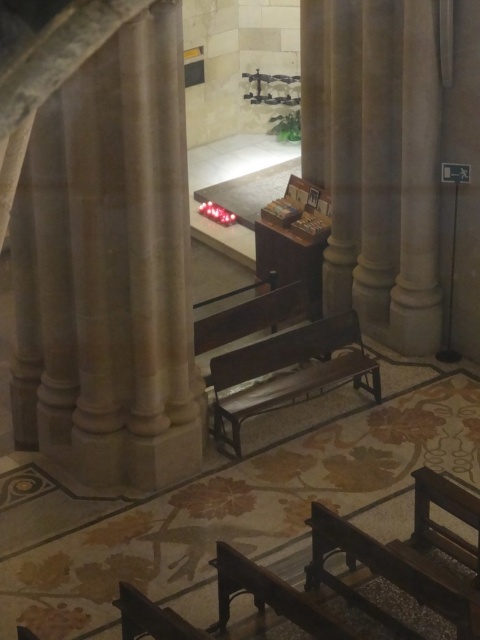
Can you confirm if beige stone pillar at left is positioned to the left of wooden bench at center?

Correct, you'll find beige stone pillar at left to the left of wooden bench at center.

Is point (187, 307) in front of point (328, 348)?

Yes, it is.

Does point (49, 323) come behind point (216, 371)?

No, (49, 323) is closer to viewer.

The width and height of the screenshot is (480, 640). Identify the location of beige stone pillar at left. click(x=109, y=268).